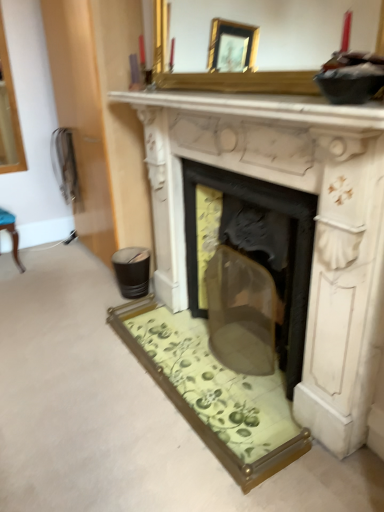
Where is `gold-framed mirror at upper center`? gold-framed mirror at upper center is located at coordinates (270, 46).

What do you see at coordinates (313, 223) in the screenshot? The width and height of the screenshot is (384, 512). I see `white marble fireplace at center` at bounding box center [313, 223].

The image size is (384, 512). Identify the location of white marble fireplace at center. (313, 223).

This screenshot has height=512, width=384. What are the coordinates of `gold-framed mirror at upper center` in the screenshot? It's located at (270, 46).

Find the location of `fireplace below the white marble fireplace at upper center (from a real-world perspective)`. fireplace below the white marble fireplace at upper center (from a real-world perspective) is located at coordinates (313, 223).

Does white marble fireplace at upper center have a greater width compared to white marble fireplace at center?

No, white marble fireplace at upper center is not wider than white marble fireplace at center.

From a real-world perspective, is white marble fireplace at upper center located beneath white marble fireplace at center?

No, from a real-world perspective, white marble fireplace at upper center is not beneath white marble fireplace at center.

Consider the image. How far apart are white marble fireplace at upper center and white marble fireplace at center?

white marble fireplace at upper center and white marble fireplace at center are 12.56 inches apart from each other.

From the image's perspective, would you say white marble fireplace at upper center is positioned over gold-framed mirror at upper center?

No, from the image's perspective, white marble fireplace at upper center is not over gold-framed mirror at upper center.

Find the location of a particular element. mantle on the left of the gold-framed mirror at upper center is located at coordinates (262, 106).

Does white marble fireplace at upper center turn towards gold-framed mirror at upper center?

No, white marble fireplace at upper center does not turn towards gold-framed mirror at upper center.

Is there a large distance between white marble fireplace at upper center and gold-framed mirror at upper center?

white marble fireplace at upper center is far away from gold-framed mirror at upper center.

Looking at this image, is gold-framed mirror at upper center located outside white marble fireplace at center?

Yes.

Which object is further away from the camera, gold-framed mirror at upper center or white marble fireplace at center?

white marble fireplace at center.

Is gold-framed mirror at upper center directly adjacent to white marble fireplace at center?

No, gold-framed mirror at upper center is not beside white marble fireplace at center.

Does point (307, 84) come closer to viewer compared to point (290, 178)?

Yes, point (307, 84) is closer to viewer.

Consider the image. Can you confirm if gold-framed mirror at upper center is positioned to the right of white marble fireplace at upper center?

Yes, gold-framed mirror at upper center is to the right of white marble fireplace at upper center.

Do you think gold-framed mirror at upper center is within white marble fireplace at upper center, or outside of it?

gold-framed mirror at upper center lies outside white marble fireplace at upper center.

How different are the orientations of gold-framed mirror at upper center and white marble fireplace at upper center in degrees?

1.94 degrees.

Considering the relative sizes of gold-framed mirror at upper center and white marble fireplace at upper center in the image provided, is gold-framed mirror at upper center wider than white marble fireplace at upper center?

No.

In the scene shown: From a real-world perspective, which is physically above, white marble fireplace at center or white marble fireplace at upper center?

In real-world perspective, white marble fireplace at upper center is above.

Is white marble fireplace at center positioned with its back to white marble fireplace at upper center?

No.

Considering the relative positions of white marble fireplace at center and white marble fireplace at upper center in the image provided, is white marble fireplace at center behind white marble fireplace at upper center?

Yes, it is behind white marble fireplace at upper center.

Consider the image. Measure the distance between white marble fireplace at center and gold-framed mirror at upper center.

white marble fireplace at center is 2.68 meters from gold-framed mirror at upper center.

Would you consider white marble fireplace at center to be distant from gold-framed mirror at upper center?

Yes, white marble fireplace at center and gold-framed mirror at upper center are quite far apart.

Find the location of `fireplace on the right of gold-framed mirror at upper center`. fireplace on the right of gold-framed mirror at upper center is located at coordinates (313, 223).

Considering the relative sizes of white marble fireplace at center and gold-framed mirror at upper center in the image provided, is white marble fireplace at center taller than gold-framed mirror at upper center?

Yes.

Locate an element on the screen. Image resolution: width=384 pixels, height=512 pixels. mantle in front of the white marble fireplace at center is located at coordinates (262, 106).

You are a GUI agent. You are given a task and a screenshot of the screen. Output one action in this format:
    pyautogui.click(x=<x>, y=<y>)
    Task: Click on the mirror above the white marble fireplace at upper center (from the image's perspective)
    This screenshot has width=384, height=512.
    Given the screenshot: What is the action you would take?
    pyautogui.click(x=270, y=46)

Based on their spatial positions, is white marble fireplace at upper center or white marble fireplace at center closer to gold-framed mirror at upper center?

white marble fireplace at upper center lies closer to gold-framed mirror at upper center than the other object.

Looking at the image, which one is located closer to white marble fireplace at upper center, white marble fireplace at center or gold-framed mirror at upper center?

white marble fireplace at center is closer to white marble fireplace at upper center.

In the scene shown: Based on their spatial positions, is gold-framed mirror at upper center or white marble fireplace at upper center closer to white marble fireplace at center?

white marble fireplace at upper center.

Considering their positions, is gold-framed mirror at upper center positioned closer to white marble fireplace at upper center than white marble fireplace at center?

white marble fireplace at center is positioned closer to the anchor white marble fireplace at upper center.

Which object lies nearer to the anchor point white marble fireplace at center, white marble fireplace at upper center or gold-framed mirror at upper center?

white marble fireplace at upper center is closer to white marble fireplace at center.

Considering their positions, is white marble fireplace at center positioned further to gold-framed mirror at upper center than white marble fireplace at upper center?

Based on the image, white marble fireplace at center appears to be further to gold-framed mirror at upper center.

I want to click on mantle that lies between gold-framed mirror at upper center and white marble fireplace at center from top to bottom, so click(262, 106).